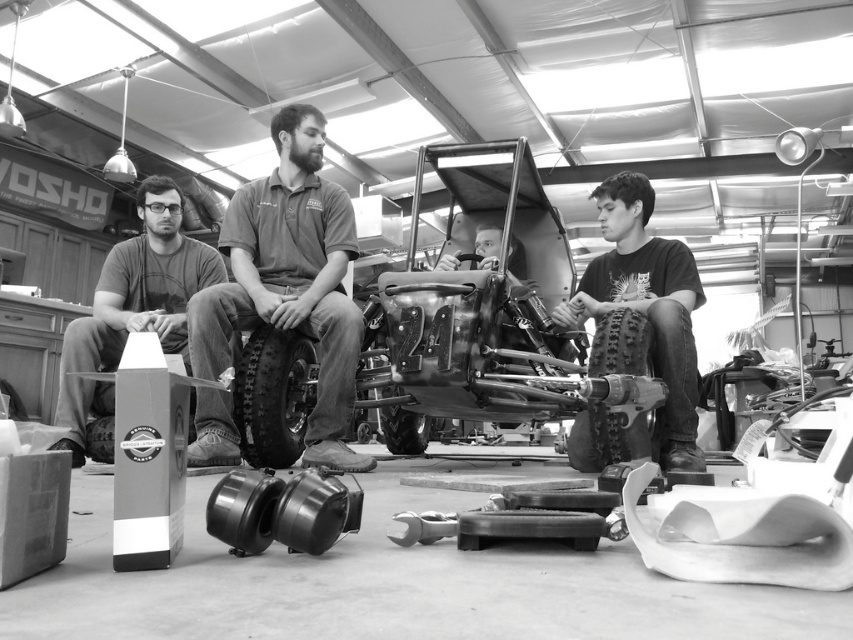
Does matte black shirt at center have a smaller size compared to rubber/textured tire at center?

Incorrect, matte black shirt at center is not smaller in size than rubber/textured tire at center.

Does matte black shirt at center appear on the left side of rubber/textured tire at center?

In fact, matte black shirt at center is to the right of rubber/textured tire at center.

Image resolution: width=853 pixels, height=640 pixels. Describe the element at coordinates (289, 280) in the screenshot. I see `matte black shirt at center` at that location.

The width and height of the screenshot is (853, 640). I want to click on matte black shirt at center, so click(x=289, y=280).

Can you confirm if black matte shirt at center is smaller than matte black box at left?

No, black matte shirt at center is not smaller than matte black box at left.

Is black matte shirt at center shorter than matte black box at left?

No, black matte shirt at center is not shorter than matte black box at left.

Does point (650, 355) lie behind point (136, 292)?

No.

I want to click on black matte shirt at center, so click(x=646, y=305).

Which is more to the left, black matte shirt at center or rubber/textured tire at lower right?

rubber/textured tire at lower right is more to the left.

Can you confirm if black matte shirt at center is thinner than rubber/textured tire at lower right?

In fact, black matte shirt at center might be wider than rubber/textured tire at lower right.

Locate an element on the screen. Image resolution: width=853 pixels, height=640 pixels. black matte shirt at center is located at coordinates (646, 305).